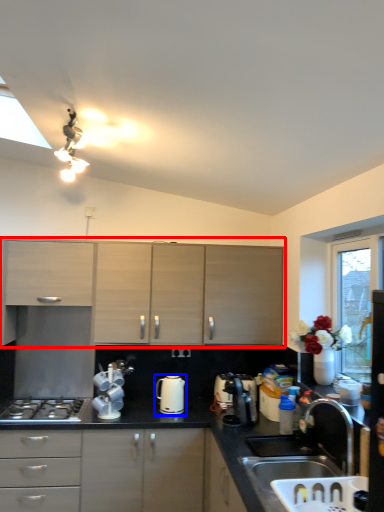
Question: Among these objects, which one is nearest to the camera, cabinetry (highlighted by a red box) or kitchen appliance (highlighted by a blue box)?

Choices:
 (A) cabinetry
 (B) kitchen appliance

Answer: (B)